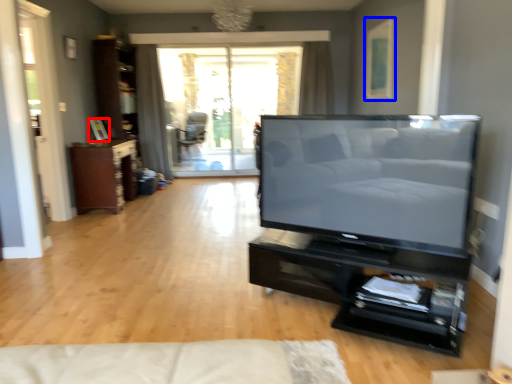
Question: Which point is closer to the camera, picture frame (highlighted by a red box) or picture frame (highlighted by a blue box)?

Choices:
 (A) picture frame
 (B) picture frame

Answer: (B)